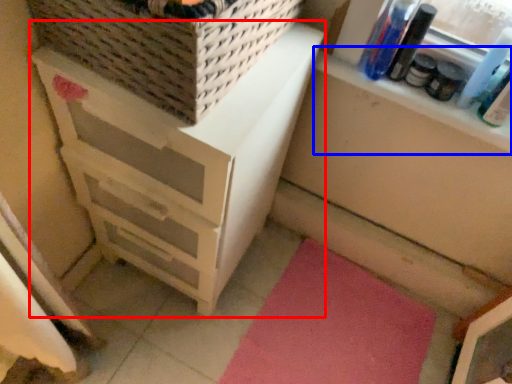
Question: Which object appears farthest to the camera in this image, chest of drawers (highlighted by a red box) or window sill (highlighted by a blue box)?

Choices:
 (A) chest of drawers
 (B) window sill

Answer: (B)